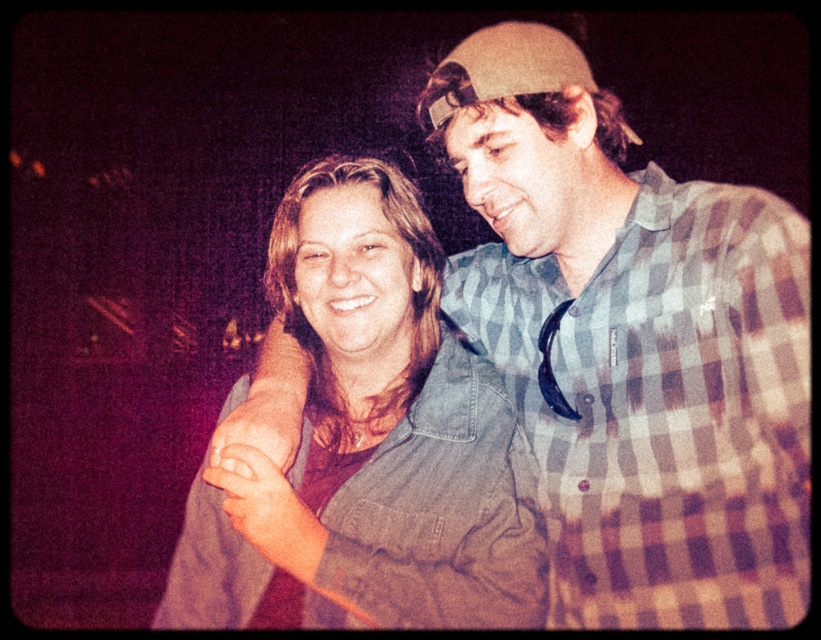
Question: Among these objects, which one is farthest from the camera?

Choices:
 (A) denim jacket at center
 (B) checkered flannel shirt at upper right

Answer: (A)

Question: Which point appears farthest from the camera in this image?

Choices:
 (A) (746, 193)
 (B) (306, 280)

Answer: (B)

Question: Is checkered flannel shirt at upper right in front of denim jacket at center?

Choices:
 (A) yes
 (B) no

Answer: (A)

Question: Can you confirm if checkered flannel shirt at upper right is positioned to the right of denim jacket at center?

Choices:
 (A) no
 (B) yes

Answer: (B)

Question: Can you confirm if checkered flannel shirt at upper right is wider than denim jacket at center?

Choices:
 (A) yes
 (B) no

Answer: (B)

Question: Among these objects, which one is farthest from the camera?

Choices:
 (A) denim jacket at center
 (B) checkered flannel shirt at upper right

Answer: (A)